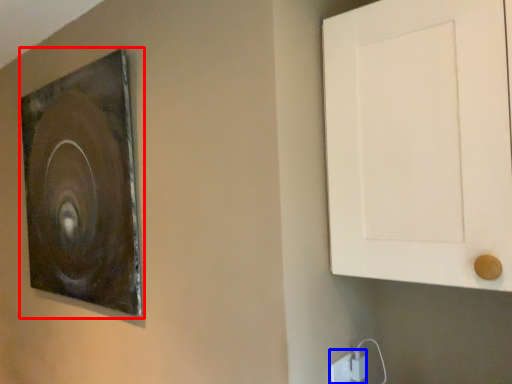
Question: Which of the following is the closest to the observer, picture frame (highlighted by a red box) or electric outlet (highlighted by a blue box)?

Choices:
 (A) picture frame
 (B) electric outlet

Answer: (B)